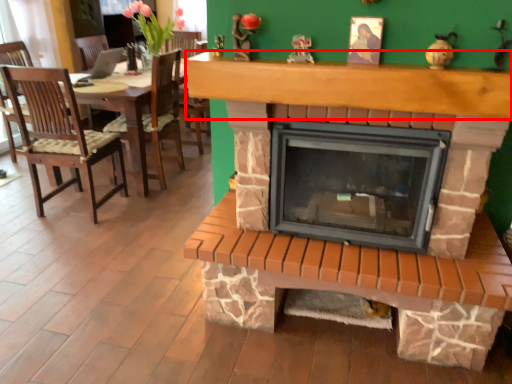
Question: In this image, where is mantle (annotated by the red box) located relative to wood burning stove?

Choices:
 (A) right
 (B) left

Answer: (B)